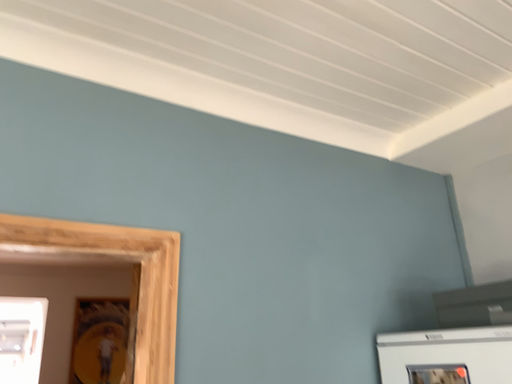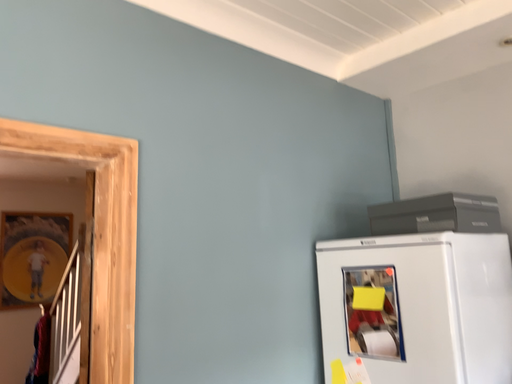
Question: How did the camera likely rotate when shooting the video?

Choices:
 (A) rotated downward
 (B) rotated upward

Answer: (A)